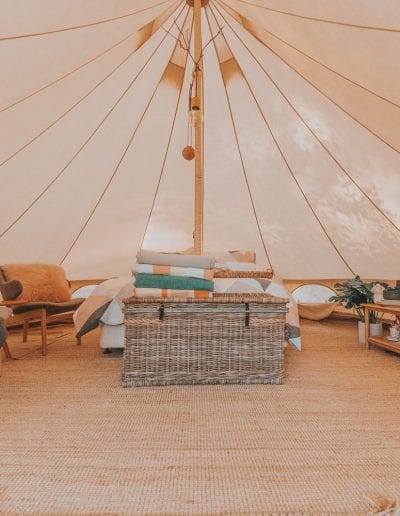
Locate an element on the screen. This screenshot has width=400, height=516. wicker is located at coordinates (155, 342).